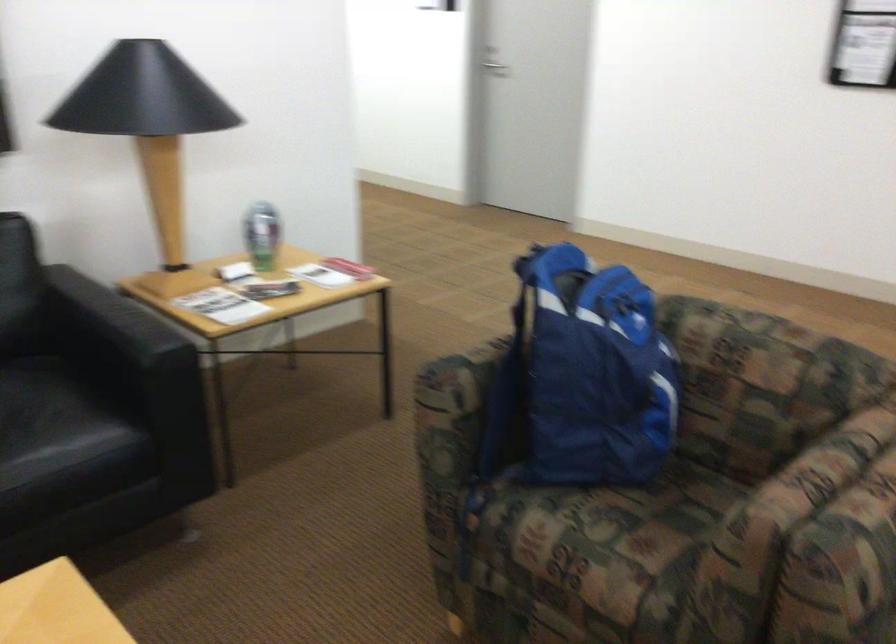
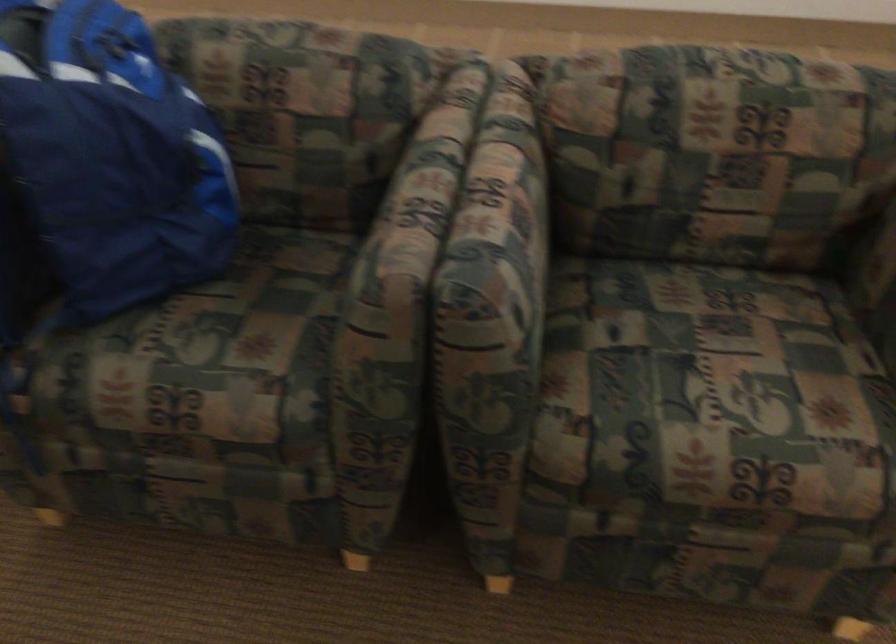
In the second image, find the point that corresponds to point (800, 478) in the first image.

(412, 207)